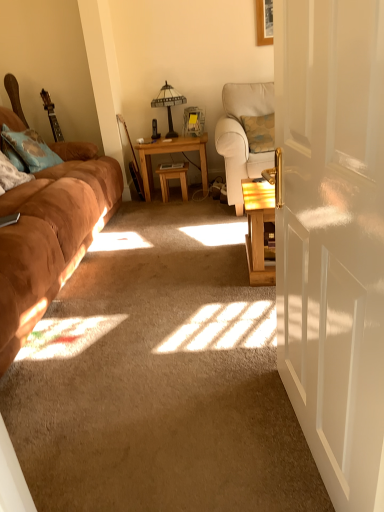
Question: Considering the relative sizes of matte plastic picture frame at center and wooden table at center, which is counted as the 2th table, starting from the left, in the image provided, is matte plastic picture frame at center bigger than wooden table at center, which is counted as the 2th table, starting from the left,?

Choices:
 (A) no
 (B) yes

Answer: (A)

Question: Can you confirm if matte plastic picture frame at center is smaller than wooden table at center, which is counted as the 2th table, starting from the left?

Choices:
 (A) yes
 (B) no

Answer: (A)

Question: Is matte plastic picture frame at center next to wooden table at center, which is counted as the 2th table, starting from the left?

Choices:
 (A) no
 (B) yes

Answer: (A)

Question: Considering the relative sizes of matte plastic picture frame at center and wooden table at center, which is counted as the 2th table, starting from the left, in the image provided, is matte plastic picture frame at center shorter than wooden table at center, which is counted as the 2th table, starting from the left,?

Choices:
 (A) yes
 (B) no

Answer: (A)

Question: Is matte plastic picture frame at center behind wooden table at center, acting as the 1th table starting from the right?

Choices:
 (A) yes
 (B) no

Answer: (A)

Question: Relative to suede brown couch at left, is light brown wooden table at center, which is the first table from left to right, in front or behind?

Choices:
 (A) behind
 (B) front

Answer: (A)

Question: Is point (201, 138) positioned closer to the camera than point (72, 228)?

Choices:
 (A) closer
 (B) farther

Answer: (B)

Question: Is light brown wooden table at center, which is the first table from left to right, to the left or to the right of suede brown couch at left in the image?

Choices:
 (A) left
 (B) right

Answer: (B)

Question: In terms of size, does light brown wooden table at center, placed as the second table when sorted from right to left, appear bigger or smaller than suede brown couch at left?

Choices:
 (A) big
 (B) small

Answer: (B)

Question: Based on their sizes in the image, would you say white glossy door at center right is bigger or smaller than matte plastic picture frame at center?

Choices:
 (A) small
 (B) big

Answer: (B)

Question: Looking at their shapes, would you say white glossy door at center right is wider or thinner than matte plastic picture frame at center?

Choices:
 (A) thin
 (B) wide

Answer: (A)

Question: From the image's perspective, relative to matte plastic picture frame at center, is white glossy door at center right above or below?

Choices:
 (A) above
 (B) below

Answer: (B)

Question: Is point (284, 179) positioned closer to the camera than point (185, 124)?

Choices:
 (A) farther
 (B) closer

Answer: (B)

Question: In the image, is white glossy door at center right positioned in front of or behind suede brown couch at left?

Choices:
 (A) behind
 (B) front

Answer: (B)

Question: Considering the relative positions of white glossy door at center right and suede brown couch at left in the image provided, is white glossy door at center right to the left or to the right of suede brown couch at left?

Choices:
 (A) right
 (B) left

Answer: (A)